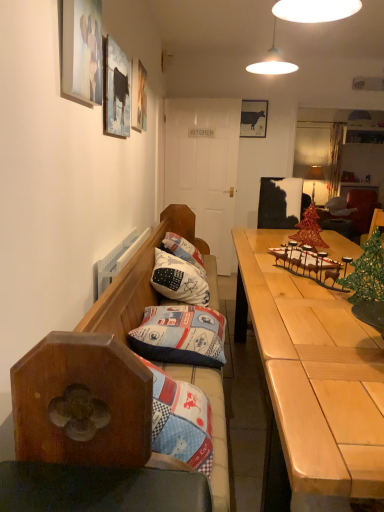
Question: From the image's perspective, does matte wooden picture frame at upper left, arranged as the 3th picture frame when viewed from the back, appear higher than matte black cow at upper center, which is the first picture frame in back-to-front order?

Choices:
 (A) no
 (B) yes

Answer: (A)

Question: Does matte wooden picture frame at upper left, arranged as the 3th picture frame when viewed from the back, have a lesser width compared to matte black cow at upper center, placed as the 4th picture frame when sorted from front to back?

Choices:
 (A) no
 (B) yes

Answer: (B)

Question: Does matte wooden picture frame at upper left, acting as the second picture frame starting from the left, have a larger size compared to matte black cow at upper center, which is the first picture frame in back-to-front order?

Choices:
 (A) yes
 (B) no

Answer: (A)

Question: Is matte black cow at upper center, which is the first picture frame in back-to-front order, at the back of matte wooden picture frame at upper left, arranged as the 3th picture frame when viewed from the back?

Choices:
 (A) no
 (B) yes

Answer: (A)

Question: Does matte wooden picture frame at upper left, arranged as the 3th picture frame when viewed from the back, have a lesser height compared to matte black cow at upper center, placed as the first picture frame when sorted from right to left?

Choices:
 (A) no
 (B) yes

Answer: (A)

Question: From a real-world perspective, is matte wooden picture frame at upper left, arranged as the 3th picture frame when viewed from the back, physically above matte black cow at upper center, placed as the first picture frame when sorted from right to left?

Choices:
 (A) no
 (B) yes

Answer: (A)

Question: From the image's perspective, is matte glass lampshade at upper right under white cotton pillow at center, placed as the first pillow when sorted from back to front?

Choices:
 (A) no
 (B) yes

Answer: (A)

Question: Is matte glass lampshade at upper right behind white cotton pillow at center, placed as the first pillow when sorted from back to front?

Choices:
 (A) no
 (B) yes

Answer: (B)

Question: Is matte glass lampshade at upper right facing towards white cotton pillow at center, placed as the first pillow when sorted from back to front?

Choices:
 (A) yes
 (B) no

Answer: (B)

Question: Can you confirm if matte glass lampshade at upper right is thinner than white cotton pillow at center, placed as the first pillow when sorted from back to front?

Choices:
 (A) yes
 (B) no

Answer: (A)

Question: From the image's perspective, does matte glass lampshade at upper right appear higher than white cotton pillow at center, placed as the first pillow when sorted from back to front?

Choices:
 (A) no
 (B) yes

Answer: (B)

Question: Would you say matte glass lampshade at upper right is a long distance from white cotton pillow at center, placed as the first pillow when sorted from back to front?

Choices:
 (A) no
 (B) yes

Answer: (B)

Question: Are velvet dark brown bean bag chair at right and wooden bench with cushions at left beside each other?

Choices:
 (A) no
 (B) yes

Answer: (A)